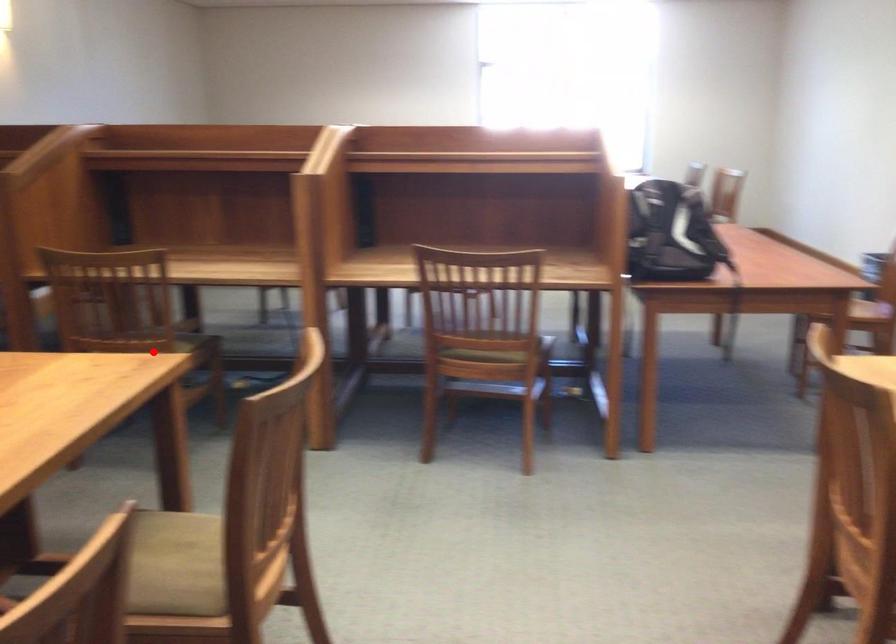
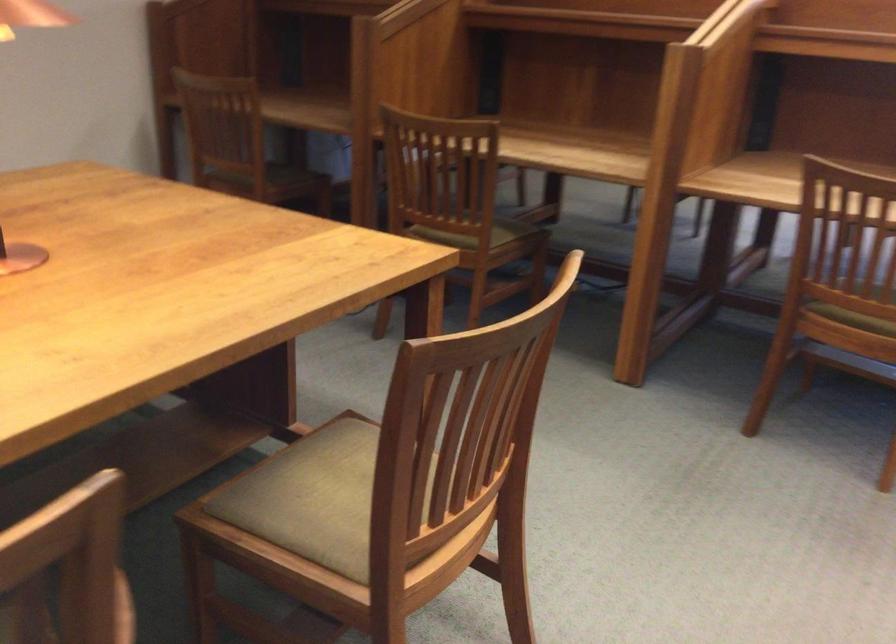
Find the pixel in the second image that matches the highlighted location in the first image.

(474, 234)